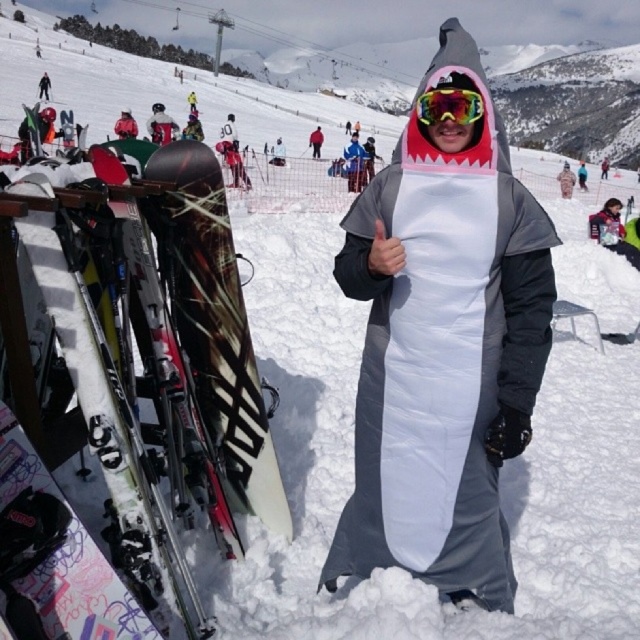
Question: Can you confirm if white glossy skis at left is thinner than dark blue snowboard at center?

Choices:
 (A) yes
 (B) no

Answer: (B)

Question: Which point is closer to the camera?

Choices:
 (A) (317, 131)
 (B) (428, 218)
 (C) (467, 124)

Answer: (B)

Question: Which is nearer to the white glossy skis at left?

Choices:
 (A) matte black ski at left
 (B) glossy plastic goggles at center

Answer: (A)

Question: Which of the following is the closest to the observer?

Choices:
 (A) (564, 193)
 (B) (145, 172)
 (C) (472, 96)

Answer: (C)

Question: Considering the relative positions of matte black ski at left and white matte snowboard at center in the image provided, where is matte black ski at left located with respect to white matte snowboard at center?

Choices:
 (A) right
 (B) left

Answer: (B)

Question: Is matte black ski at left above white matte snowboard at center?

Choices:
 (A) yes
 (B) no

Answer: (B)